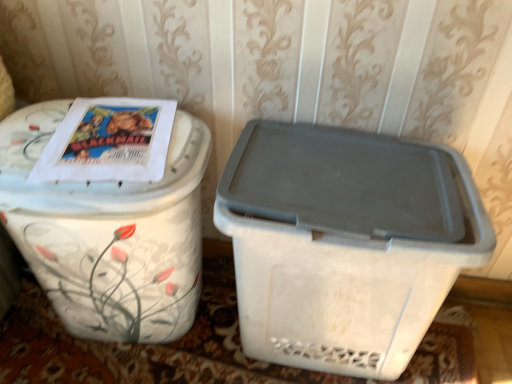
Question: In terms of size, does white glossy trash can at upper left, arranged as the 1th waste container when viewed from the left, appear bigger or smaller than white plastic container at right, the second waste container from the left?

Choices:
 (A) small
 (B) big

Answer: (B)

Question: Relative to white plastic container at right, which ranks as the first waste container in right-to-left order, is white glossy trash can at upper left, acting as the 2th waste container starting from the right, in front or behind?

Choices:
 (A) front
 (B) behind

Answer: (A)

Question: From the image's perspective, is white glossy trash can at upper left, arranged as the 1th waste container when viewed from the left, positioned above or below white plastic container at right, which ranks as the first waste container in right-to-left order?

Choices:
 (A) above
 (B) below

Answer: (A)

Question: From a real-world perspective, is white plastic container at right, the second waste container from the left, positioned above or below white glossy trash can at upper left, acting as the 2th waste container starting from the right?

Choices:
 (A) above
 (B) below

Answer: (B)

Question: Is white plastic container at right, the second waste container from the left, situated inside white glossy trash can at upper left, acting as the 2th waste container starting from the right, or outside?

Choices:
 (A) outside
 (B) inside

Answer: (A)

Question: Is white plastic container at right, which ranks as the first waste container in right-to-left order, in front of or behind white glossy trash can at upper left, acting as the 2th waste container starting from the right, in the image?

Choices:
 (A) front
 (B) behind

Answer: (B)

Question: From their relative heights in the image, would you say white plastic container at right, the second waste container from the left, is taller or shorter than white glossy trash can at upper left, acting as the 2th waste container starting from the right?

Choices:
 (A) short
 (B) tall

Answer: (A)